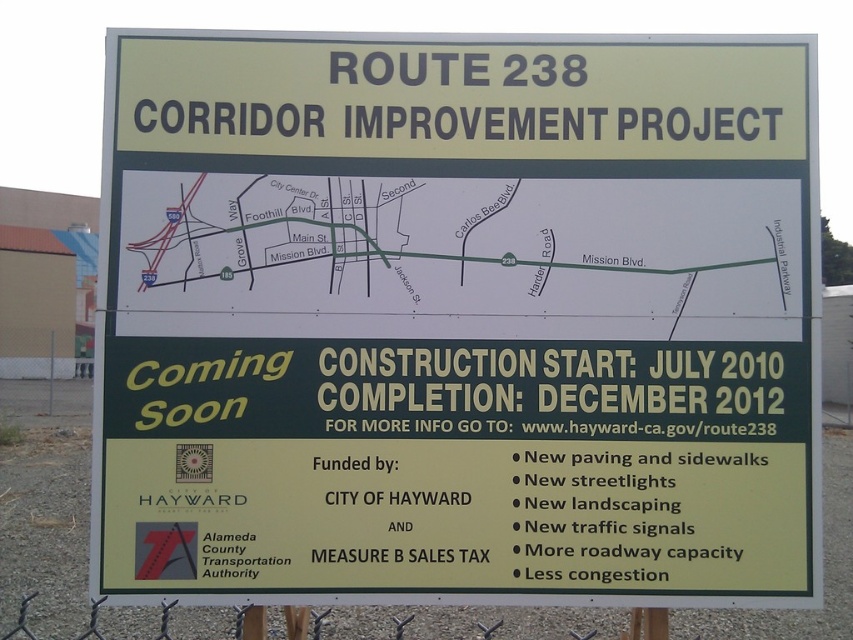
Does metal wire fence at lower center appear on the left side of metallic chain-link fence at lower left?

In fact, metal wire fence at lower center is to the right of metallic chain-link fence at lower left.

Who is shorter, metal wire fence at lower center or metallic chain-link fence at lower left?

metal wire fence at lower center

In order to click on metal wire fence at lower center in this screenshot , I will do `click(646, 625)`.